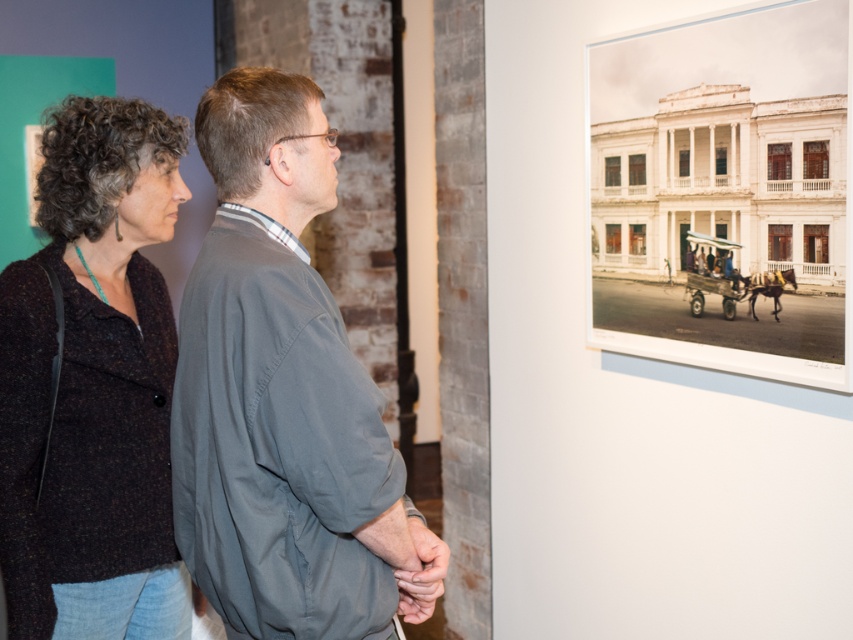
Which is behind, point (215, 516) or point (103, 97)?

Positioned behind is point (103, 97).

Which is more to the right, gray fabric shirt at center or dark speckled fabric at upper left?

gray fabric shirt at center

Image resolution: width=853 pixels, height=640 pixels. Describe the element at coordinates (283, 397) in the screenshot. I see `gray fabric shirt at center` at that location.

I want to click on gray fabric shirt at center, so click(283, 397).